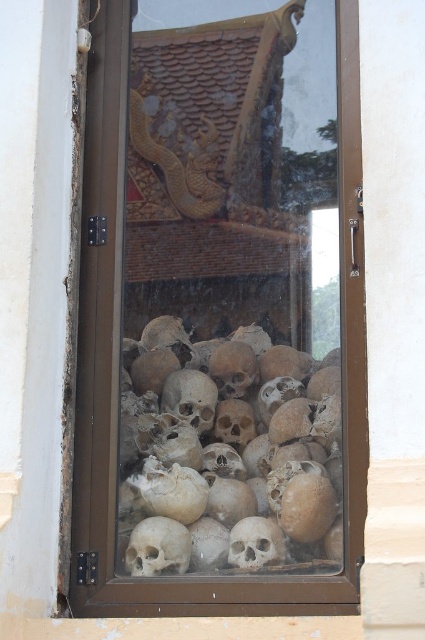
Can you confirm if transparent glass skulls at center is positioned to the right of brown textured skull at center?

Incorrect, transparent glass skulls at center is not on the right side of brown textured skull at center.

Between transparent glass skulls at center and brown textured skull at center, which one appears on the right side from the viewer's perspective?

Positioned to the right is brown textured skull at center.

This screenshot has width=425, height=640. I want to click on transparent glass skulls at center, so click(x=218, y=323).